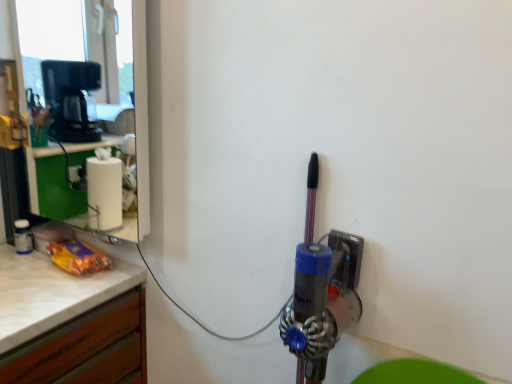
This screenshot has width=512, height=384. Describe the element at coordinates (139, 129) in the screenshot. I see `transparent glass door at upper left` at that location.

This screenshot has height=384, width=512. Find the location of `transparent glass door at upper left`. transparent glass door at upper left is located at coordinates (139, 129).

Where is `transparent glass door at upper left`? The width and height of the screenshot is (512, 384). transparent glass door at upper left is located at coordinates (139, 129).